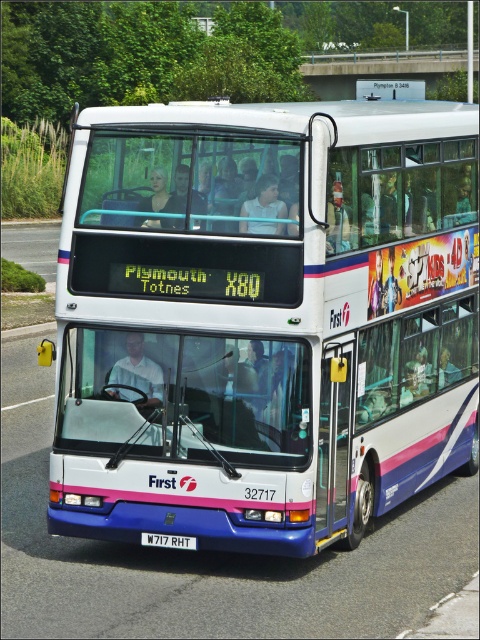
You are a pedestrian standing on the sidewalk next to the asphalt road at left. You want to cross the road to reach the park on the other side. Is the white glossy decker bus at center blocking your path?

The white glossy decker bus at center is to the right of asphalt road at left, so it is positioned on the same side as the pedestrian. Therefore, the bus is not blocking the path to cross the road to the park on the other side.

You are a delivery person who needs to transport a 7.5 meter long cargo truck through a narrow alleyway. The alleyway has a white glossy decker bus at center parked perpendicular to the alleyway entrance. What is the minimum width of the alleyway required to allow the truck to pass safely?

The minimum width of the alleyway must be at least 8.08 meters to safely accommodate the 7.5 meter long cargo truck passing by the white glossy decker bus at center parked perpendicular to the alleyway entrance.